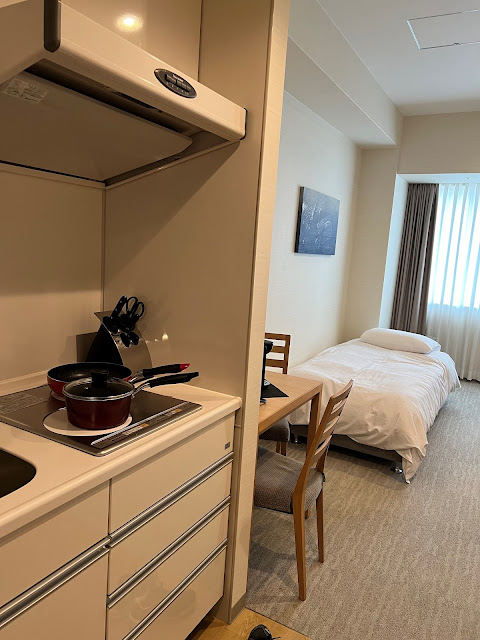
Locate where you'd lay your head in the image. Your answer should be formatted as a list of tuples, i.e. [(x1, y1), (x2, y2), ...], where each tuple contains the x and y coordinates of a point satisfying the conditions above.

[(404, 342)]